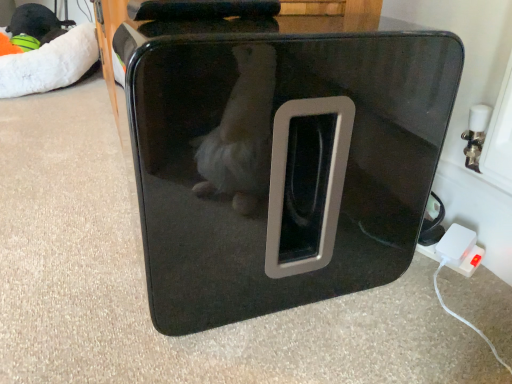
Question: From the image's perspective, is white plush bean bag at upper left over glossy black pet carrier at center?

Choices:
 (A) no
 (B) yes

Answer: (B)

Question: Considering the relative positions of white plush bean bag at upper left and glossy black pet carrier at center in the image provided, is white plush bean bag at upper left in front of glossy black pet carrier at center?

Choices:
 (A) no
 (B) yes

Answer: (A)

Question: Considering the relative sizes of white plush bean bag at upper left and glossy black pet carrier at center in the image provided, is white plush bean bag at upper left wider than glossy black pet carrier at center?

Choices:
 (A) yes
 (B) no

Answer: (A)

Question: Does white plush bean bag at upper left contain glossy black pet carrier at center?

Choices:
 (A) no
 (B) yes

Answer: (A)

Question: From a real-world perspective, does white plush bean bag at upper left stand above glossy black pet carrier at center?

Choices:
 (A) no
 (B) yes

Answer: (A)

Question: Is white plush bean bag at upper left not within glossy black pet carrier at center?

Choices:
 (A) yes
 (B) no

Answer: (A)

Question: From a real-world perspective, is glossy black pet carrier at center over white plastic power adapter at lower right?

Choices:
 (A) yes
 (B) no

Answer: (A)

Question: Is white plastic power adapter at lower right a part of glossy black pet carrier at center?

Choices:
 (A) yes
 (B) no

Answer: (B)

Question: Is glossy black pet carrier at center behind white plastic power adapter at lower right?

Choices:
 (A) yes
 (B) no

Answer: (B)

Question: From a real-world perspective, is glossy black pet carrier at center physically below white plastic power adapter at lower right?

Choices:
 (A) yes
 (B) no

Answer: (B)

Question: Is glossy black pet carrier at center at the right side of white plastic power adapter at lower right?

Choices:
 (A) no
 (B) yes

Answer: (A)

Question: Can you see glossy black pet carrier at center touching white plastic power adapter at lower right?

Choices:
 (A) yes
 (B) no

Answer: (B)

Question: Is white plastic power adapter at lower right oriented towards white plush bean bag at upper left?

Choices:
 (A) no
 (B) yes

Answer: (A)